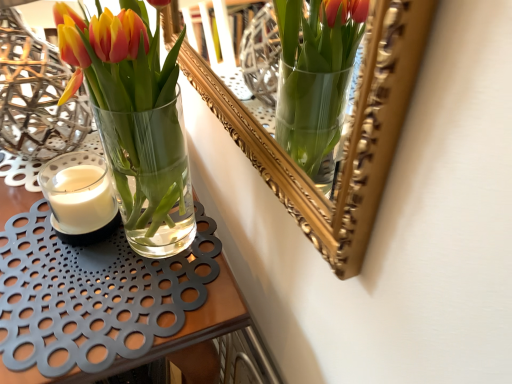
Where is `vacant space in front of white matte candle at left`? This screenshot has height=384, width=512. vacant space in front of white matte candle at left is located at coordinates (72, 290).